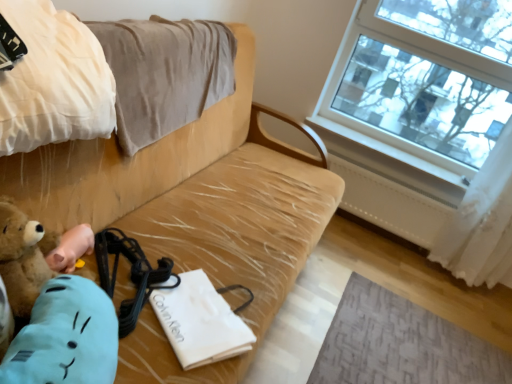
Question: Can you confirm if beige cotton blanket at upper left, the second blanket when ordered from back to front, is positioned to the left of beige cotton blanket at upper left, the 2th blanket when ordered from front to back?

Choices:
 (A) no
 (B) yes

Answer: (B)

Question: Can you confirm if beige cotton blanket at upper left, placed as the first blanket when sorted from front to back, is taller than beige cotton blanket at upper left, the first blanket in the back-to-front sequence?

Choices:
 (A) yes
 (B) no

Answer: (B)

Question: Is beige cotton blanket at upper left, the second blanket when ordered from back to front, not inside beige cotton blanket at upper left, the 2th blanket when ordered from front to back?

Choices:
 (A) yes
 (B) no

Answer: (A)

Question: Is beige cotton blanket at upper left, the second blanket when ordered from back to front, positioned far away from beige cotton blanket at upper left, the first blanket in the back-to-front sequence?

Choices:
 (A) yes
 (B) no

Answer: (B)

Question: From the image's perspective, is beige cotton blanket at upper left, placed as the first blanket when sorted from front to back, below beige cotton blanket at upper left, the first blanket in the back-to-front sequence?

Choices:
 (A) yes
 (B) no

Answer: (A)

Question: In terms of width, does white painted wood at upper right look wider or thinner when compared to transparent glass window at upper right?

Choices:
 (A) wide
 (B) thin

Answer: (A)

Question: Considering the positions of white painted wood at upper right and transparent glass window at upper right in the image, is white painted wood at upper right taller or shorter than transparent glass window at upper right?

Choices:
 (A) tall
 (B) short

Answer: (B)

Question: Considering the positions of point (306, 120) and point (338, 56), is point (306, 120) closer or farther from the camera than point (338, 56)?

Choices:
 (A) closer
 (B) farther

Answer: (B)

Question: Considering their positions, is white painted wood at upper right located in front of or behind transparent glass window at upper right?

Choices:
 (A) behind
 (B) front

Answer: (A)

Question: From a real-world perspective, relative to brown plush toy at lower left, is white paper bag at center vertically above or below?

Choices:
 (A) below
 (B) above

Answer: (A)

Question: Considering the positions of point (225, 312) and point (87, 238), is point (225, 312) closer or farther from the camera than point (87, 238)?

Choices:
 (A) farther
 (B) closer

Answer: (B)

Question: Considering the relative positions of white paper bag at center and brown plush toy at lower left in the image provided, is white paper bag at center to the left or to the right of brown plush toy at lower left?

Choices:
 (A) left
 (B) right

Answer: (B)

Question: Is white paper bag at center wider or thinner than brown plush toy at lower left?

Choices:
 (A) wide
 (B) thin

Answer: (A)

Question: Visually, is brown plush toy at lower left positioned to the left or to the right of beige cotton blanket at upper left, the second blanket when ordered from back to front?

Choices:
 (A) left
 (B) right

Answer: (B)

Question: In terms of size, does brown plush toy at lower left appear bigger or smaller than beige cotton blanket at upper left, the second blanket when ordered from back to front?

Choices:
 (A) small
 (B) big

Answer: (A)